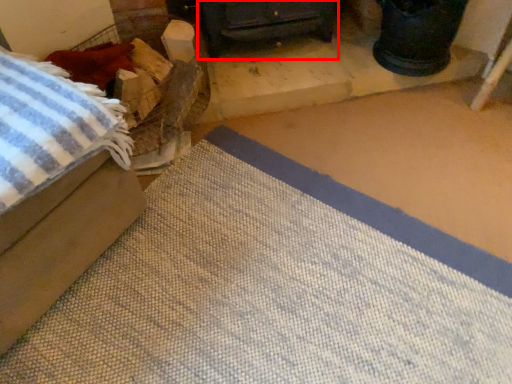
Question: From the image's perspective, what is the correct spatial positioning of furniture (annotated by the red box) in reference to furniture?

Choices:
 (A) below
 (B) above

Answer: (B)